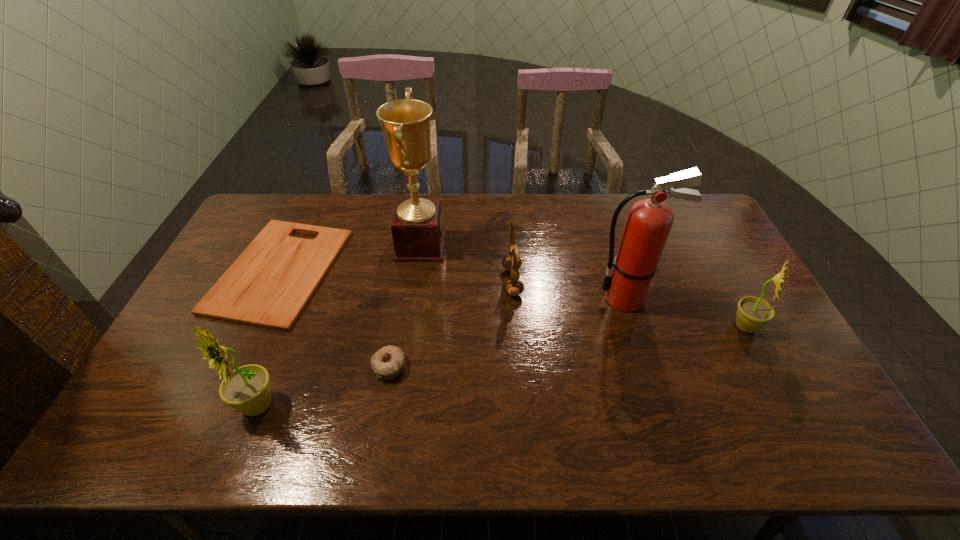
Find the location of `trophy cup at the far edge`. trophy cup at the far edge is located at coordinates (417, 229).

The image size is (960, 540). I want to click on chopping board situated at the far edge, so click(x=270, y=283).

Image resolution: width=960 pixels, height=540 pixels. I want to click on sunflower that is at the near edge, so click(247, 389).

Where is `doughnut situated at the near edge`? The image size is (960, 540). doughnut situated at the near edge is located at coordinates (388, 362).

This screenshot has height=540, width=960. I want to click on object situated at the left edge, so click(270, 283).

Locate an element on the screen. object that is at the right edge is located at coordinates (753, 313).

The image size is (960, 540). I want to click on object present at the far left corner, so click(270, 283).

In the image, there is a desktop. Identify the location of vacant space at the far edge. Image resolution: width=960 pixels, height=540 pixels. (623, 195).

Find the location of a particular element. free space at the near edge is located at coordinates (429, 398).

This screenshot has height=540, width=960. What are the coordinates of `vacant position at the near right corner of the desktop` in the screenshot? It's located at (780, 391).